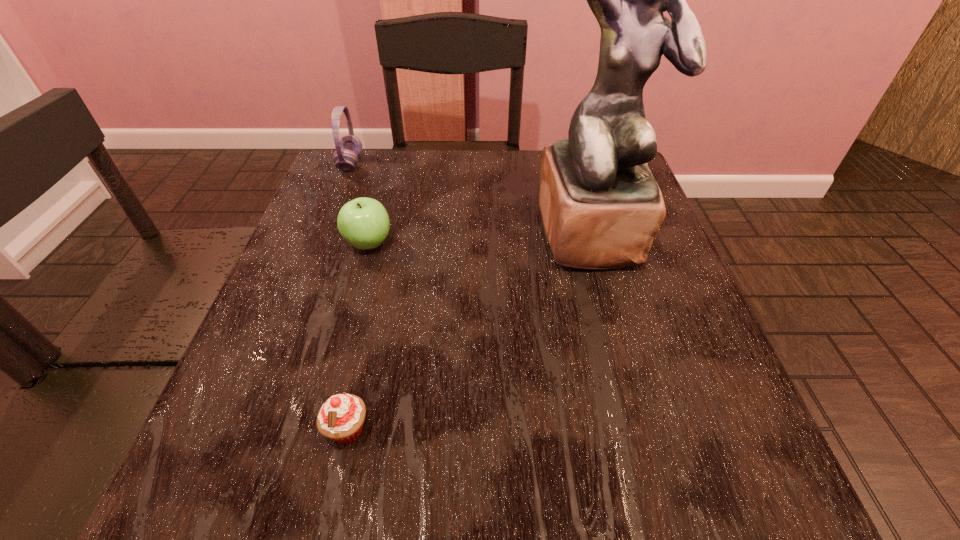
Locate an element on the screen. The height and width of the screenshot is (540, 960). the rightmost object is located at coordinates (601, 207).

This screenshot has width=960, height=540. Find the location of `the tallest object`. the tallest object is located at coordinates (601, 207).

At what (x,y) coordinates should I click in order to perform the action: click on headset. Please return your answer as a coordinate pair (x, y). Looking at the image, I should click on (349, 147).

Image resolution: width=960 pixels, height=540 pixels. In order to click on the farthest object in this screenshot , I will do coord(349,147).

Identify the location of apple. (363, 222).

Find the location of a particular element. the nearest object is located at coordinates (341, 418).

Locate an element on the screen. The height and width of the screenshot is (540, 960). cupcake is located at coordinates (341, 418).

Locate an element on the screen. vacant space located in a relaxed pose on the tallest object is located at coordinates (632, 369).

Where is `vacant space situated on the headband and ear cups of the leftmost object`? The width and height of the screenshot is (960, 540). vacant space situated on the headband and ear cups of the leftmost object is located at coordinates (438, 164).

Where is `vacant position located on the back of the apple`? vacant position located on the back of the apple is located at coordinates pyautogui.click(x=382, y=193).